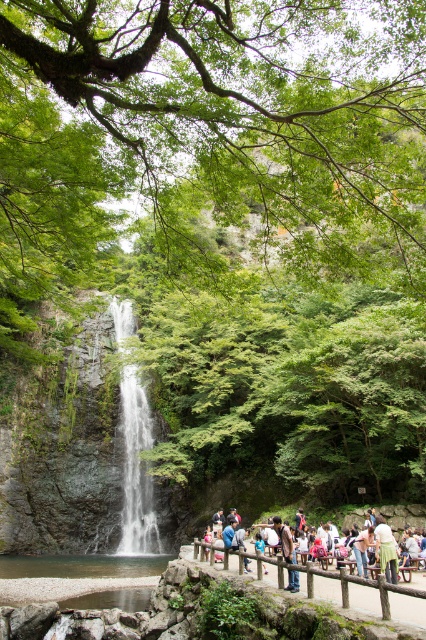
Question: Which of the following is the closest to the observer?

Choices:
 (A) (388, 573)
 (B) (253, 556)
 (C) (134, 461)

Answer: (A)

Question: Which point is farther to the camera?

Choices:
 (A) green fabric dress at center
 (B) wooden fence at center

Answer: (A)

Question: Is white glossy waterfall at center further to the viewer compared to green fabric dress at center?

Choices:
 (A) no
 (B) yes

Answer: (B)

Question: Can you confirm if white glossy waterfall at center is positioned below green fabric dress at center?

Choices:
 (A) yes
 (B) no

Answer: (B)

Question: Does wooden fence at center come in front of green fabric dress at center?

Choices:
 (A) yes
 (B) no

Answer: (A)

Question: Which point is farther to the camera?

Choices:
 (A) (195, 548)
 (B) (385, 540)
 (C) (123, 321)

Answer: (C)